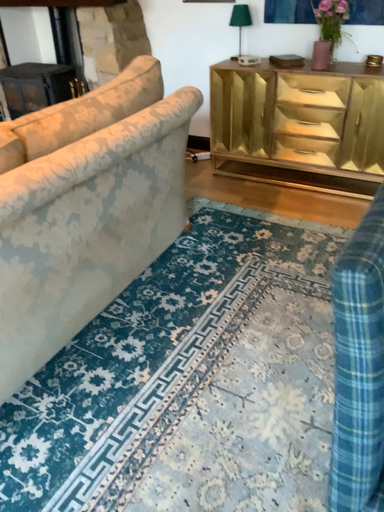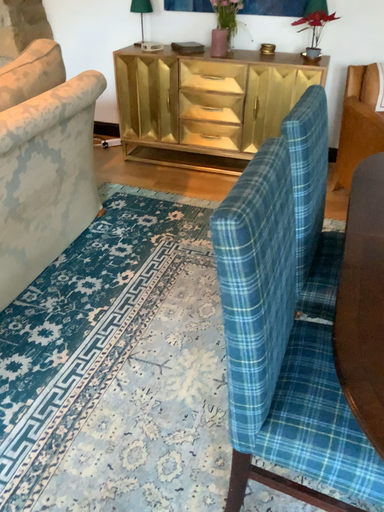
Question: Which way did the camera rotate in the video?

Choices:
 (A) rotated right
 (B) rotated left

Answer: (A)